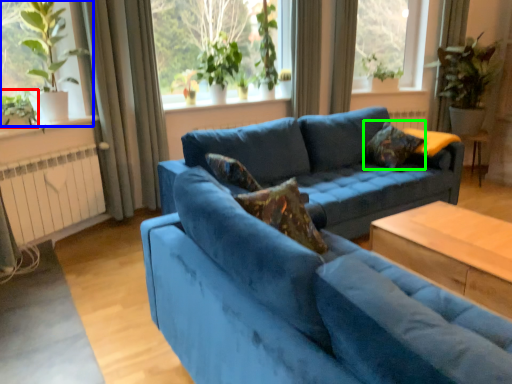
Question: Considering the real-world distances, which object is farthest from plant (highlighted by a red box)? window (highlighted by a blue box) or pillow (highlighted by a green box)?

Choices:
 (A) window
 (B) pillow

Answer: (B)